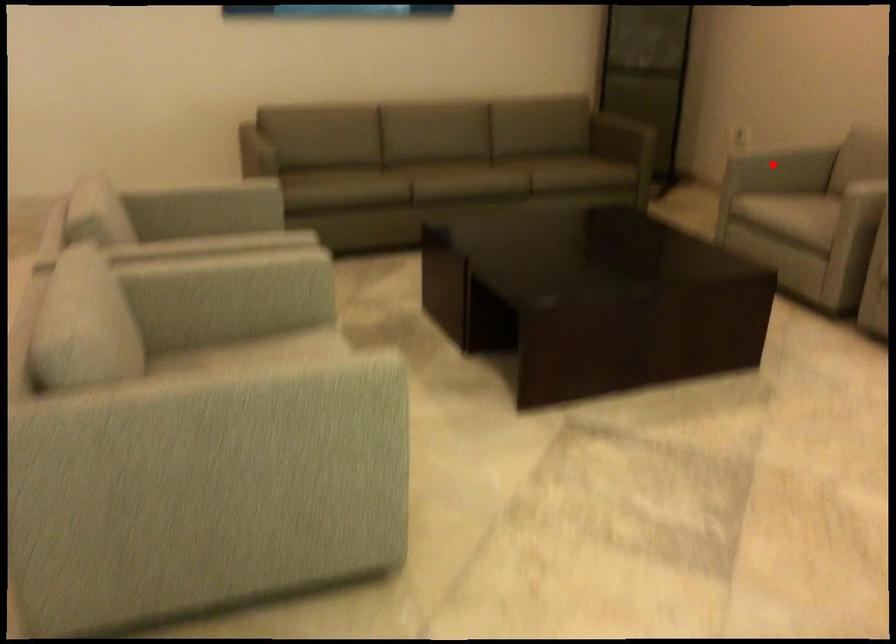
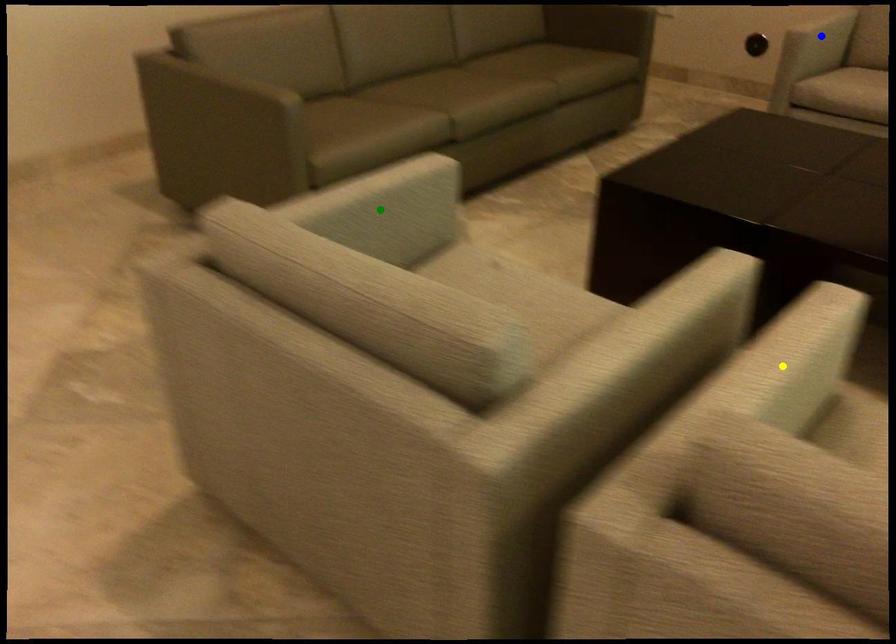
Question: I am providing you with two images of the same scene from different viewpoints. A red point is marked on the first image. You are given multiple points on the second image. Which mark in image 2 goes with the point in image 1?

Choices:
 (A) green point
 (B) blue point
 (C) yellow point

Answer: (B)